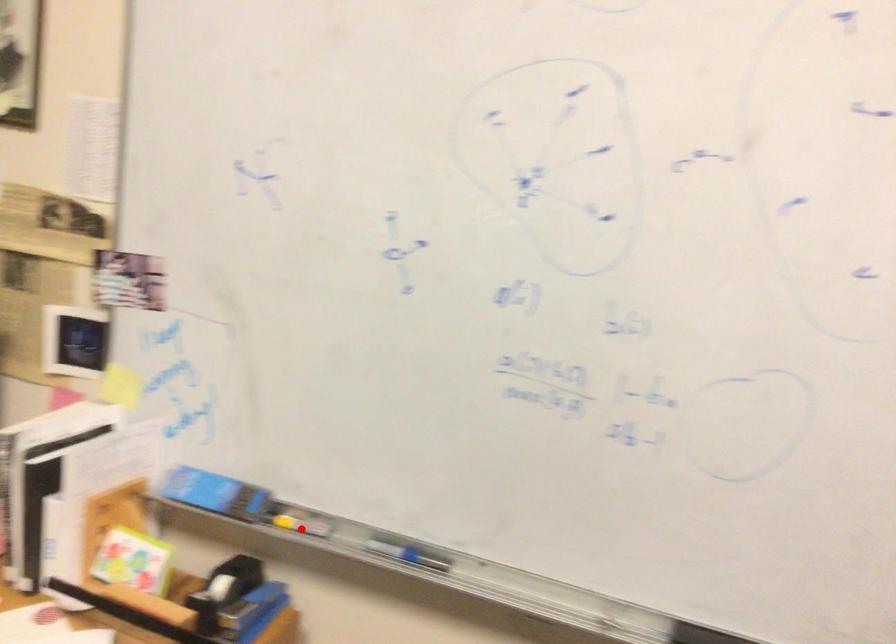
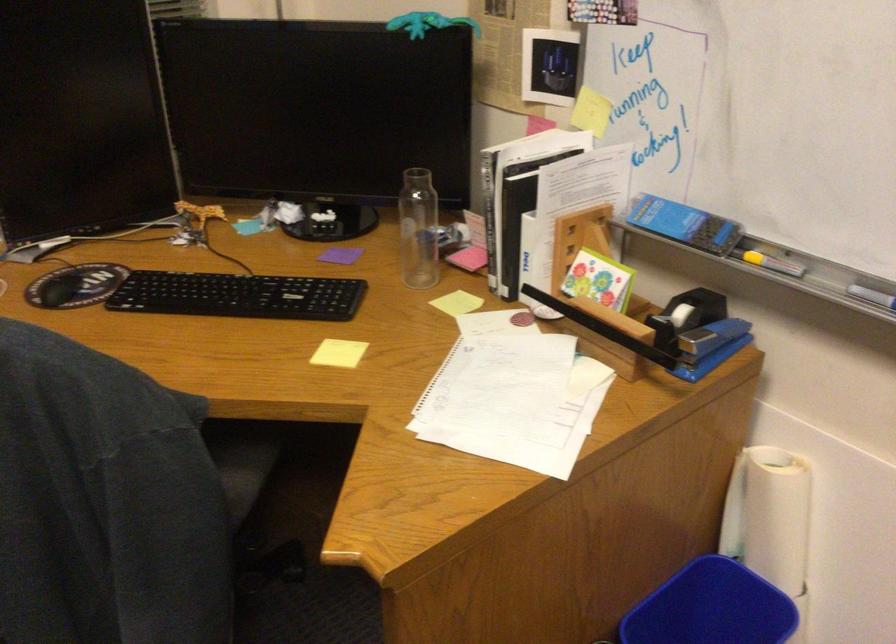
The point at the highlighted location is marked in the first image. Where is the corresponding point in the second image?

(769, 261)